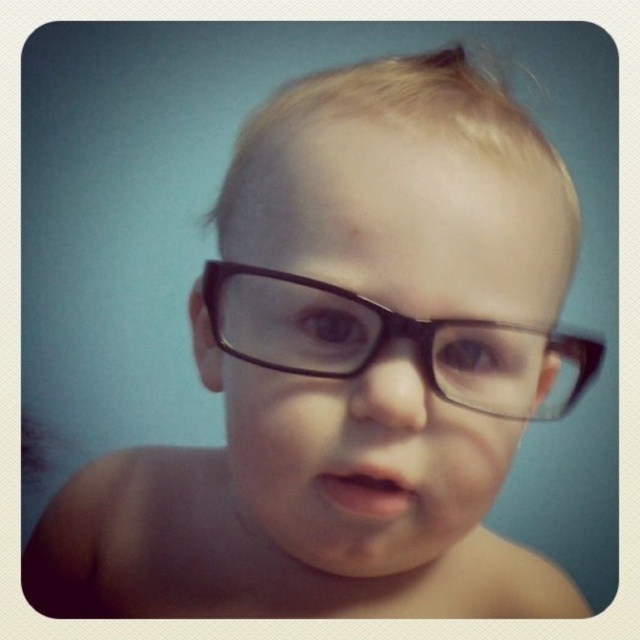
Question: Is black matte glasses at center in front of black plastic glasses at center?

Choices:
 (A) no
 (B) yes

Answer: (A)

Question: Which object appears farthest from the camera in this image?

Choices:
 (A) black matte glasses at center
 (B) black plastic glasses at center

Answer: (A)

Question: From the image, what is the correct spatial relationship of black matte glasses at center in relation to black plastic glasses at center?

Choices:
 (A) above
 (B) below

Answer: (A)

Question: Which object is closer to the camera taking this photo?

Choices:
 (A) black plastic glasses at center
 (B) black matte glasses at center

Answer: (A)

Question: Does black matte glasses at center lie in front of black plastic glasses at center?

Choices:
 (A) yes
 (B) no

Answer: (B)